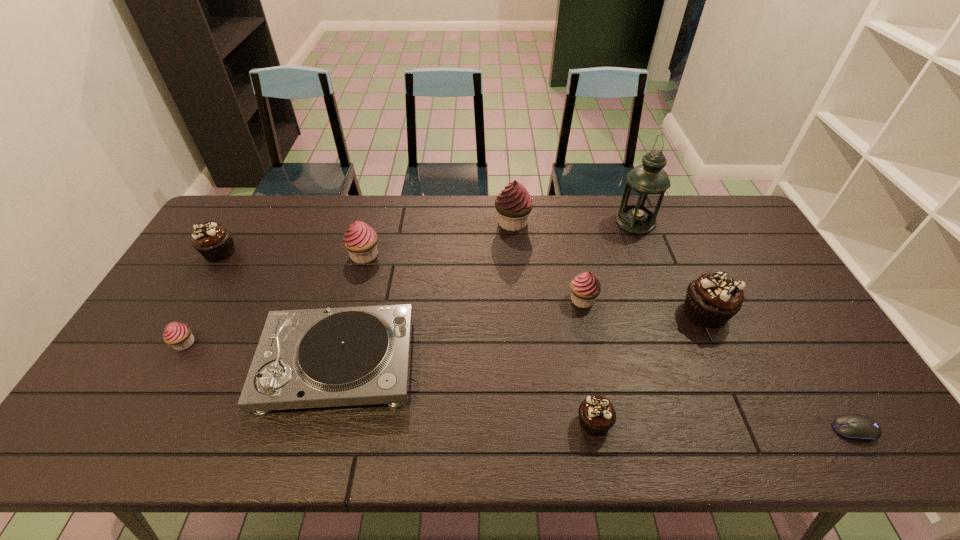
Find the location of a particular element. Image resolution: width=960 pixels, height=540 pixels. oil lamp is located at coordinates (646, 184).

Where is `the tallest object`? The width and height of the screenshot is (960, 540). the tallest object is located at coordinates (646, 184).

At what (x,y) coordinates should I click in order to perform the action: click on the ninth shortest object. Please return your answer as a coordinate pair (x, y). Image resolution: width=960 pixels, height=540 pixels. Looking at the image, I should click on (514, 204).

You are a GUI agent. You are given a task and a screenshot of the screen. Output one action in this format:
    pyautogui.click(x=<x>, y=<y>)
    Task: Click on the third pink cupcake from left to right
    
    Given the screenshot: What is the action you would take?
    pyautogui.click(x=514, y=204)

You are a GUI agent. You are given a task and a screenshot of the screen. Output one action in this format:
    pyautogui.click(x=<x>, y=<y>)
    Task: Click on the biggest brown cupcake
    The image size is (960, 540).
    Given the screenshot: What is the action you would take?
    pyautogui.click(x=713, y=299)

The height and width of the screenshot is (540, 960). Identify the location of the rightmost cupcake. (713, 299).

This screenshot has width=960, height=540. I want to click on the third cupcake from left to right, so click(360, 240).

The height and width of the screenshot is (540, 960). In order to click on the second pink cupcake from left to right in this screenshot , I will do `click(360, 240)`.

Image resolution: width=960 pixels, height=540 pixels. I want to click on the second biggest brown cupcake, so click(x=215, y=243).

You are a GUI agent. You are given a task and a screenshot of the screen. Output one action in this format:
    pyautogui.click(x=<x>, y=<y>)
    Task: Click on the leftmost brown cupcake
    The height and width of the screenshot is (540, 960).
    Given the screenshot: What is the action you would take?
    pyautogui.click(x=215, y=243)